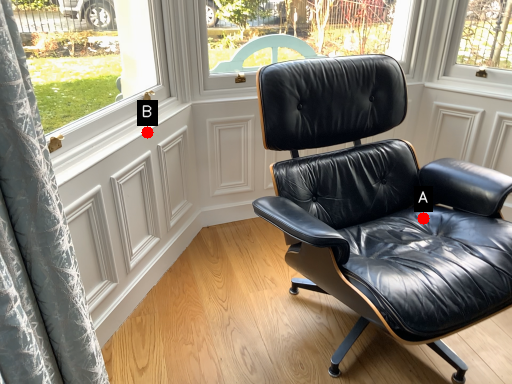
Question: Two points are circled on the image, labeled by A and B beside each circle. Which point appears closest to the camera in this image?

Choices:
 (A) A is closer
 (B) B is closer

Answer: (B)